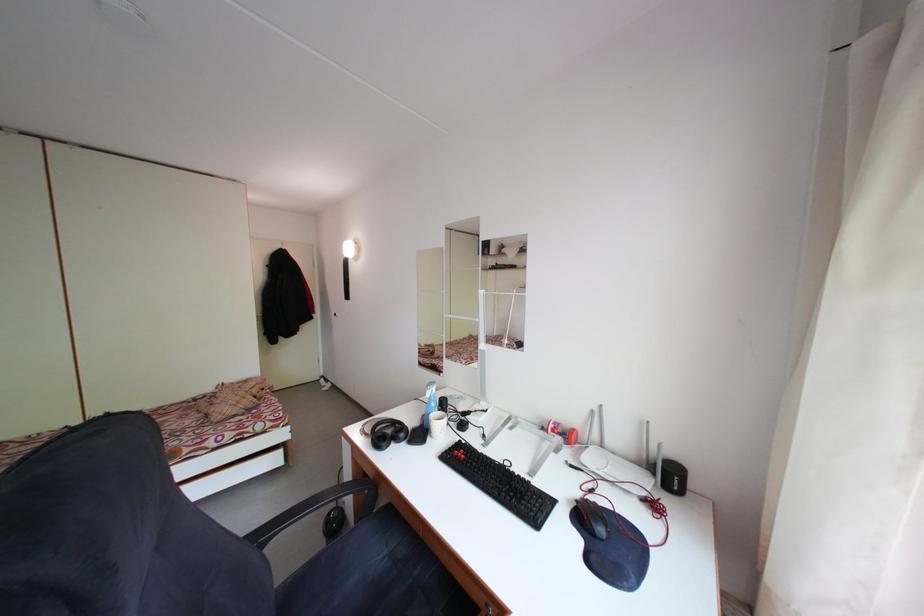
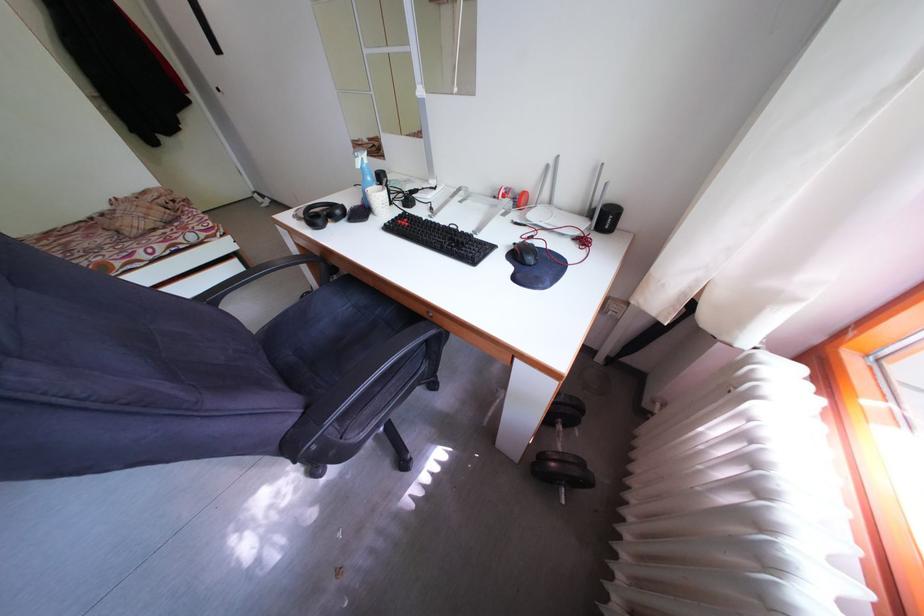
Find the pixel in the second image that matches point 659,474 in the first image.

(599, 220)